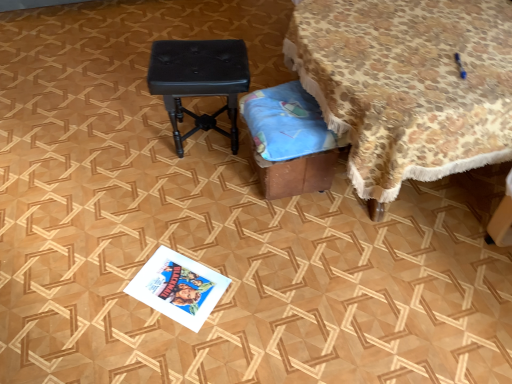
Where is `free spot to the left of floral fabric-covered table at upper right`? free spot to the left of floral fabric-covered table at upper right is located at coordinates (200, 230).